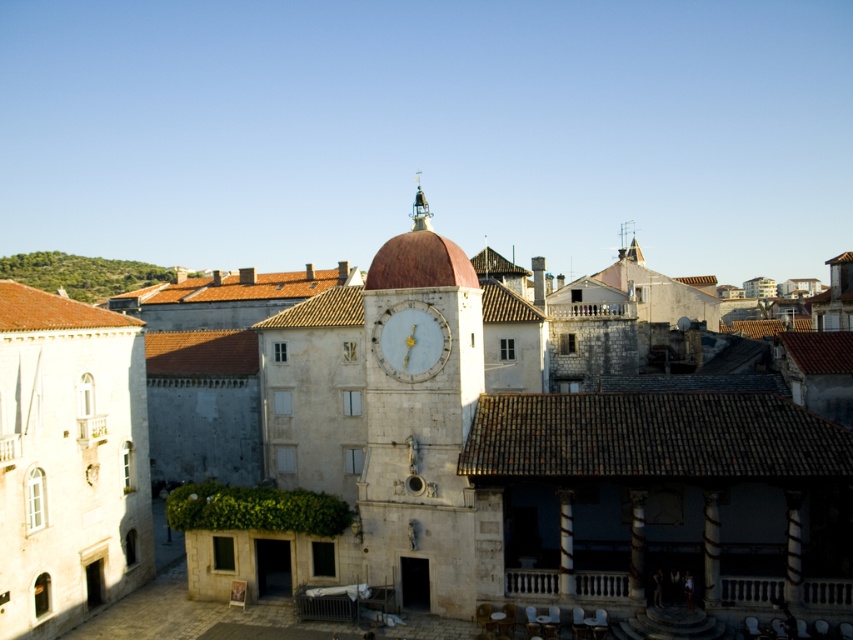
Question: Which object is farther from the camera taking this photo?

Choices:
 (A) light blue marble clock at center
 (B) white stone clock tower at center
 (C) smooth stone clock tower at center

Answer: (C)

Question: Does white stone clock tower at center have a lesser width compared to light blue marble clock at center?

Choices:
 (A) yes
 (B) no

Answer: (B)

Question: Does white stone clock tower at center appear under light blue marble clock at center?

Choices:
 (A) yes
 (B) no

Answer: (B)

Question: Among these points, which one is nearest to the camera?

Choices:
 (A) (389, 324)
 (B) (469, 333)
 (C) (547, 408)

Answer: (A)

Question: Which of the following is the farthest from the observer?

Choices:
 (A) (437, 472)
 (B) (398, 380)
 (C) (426, 349)

Answer: (B)

Question: Does white stone clock tower at center appear under light blue marble clock at center?

Choices:
 (A) yes
 (B) no

Answer: (B)